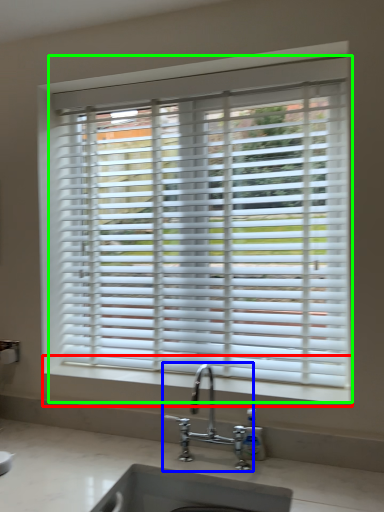
Question: Based on their relative distances, which object is farther from window sill (highlighted by a red box)? Choose from tap (highlighted by a blue box) and window blind (highlighted by a green box).

Choices:
 (A) tap
 (B) window blind

Answer: (B)